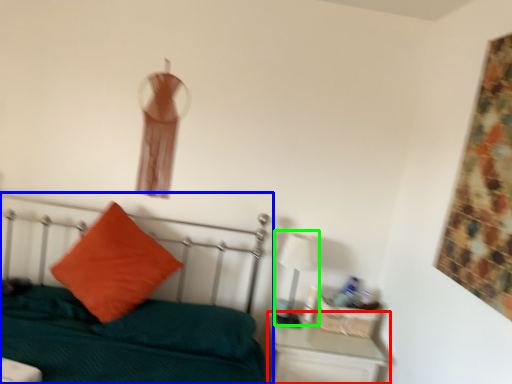
Question: Which is nearer to the nightstand (highlighted by a red box)? bed (highlighted by a blue box) or table lamp (highlighted by a green box).

Choices:
 (A) bed
 (B) table lamp

Answer: (B)